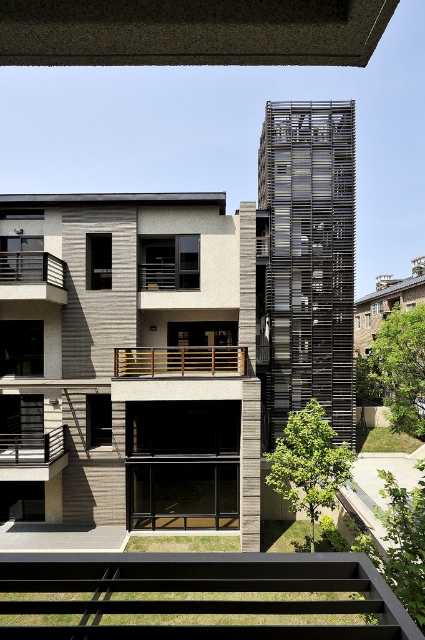
Question: Considering the real-world distances, which object is farthest from the black metal railing at lower left?

Choices:
 (A) wooden railing at center
 (B) brown wooden railing at left

Answer: (B)

Question: Among these objects, which one is farthest from the camera?

Choices:
 (A) brown wooden railing at left
 (B) black metal balustrade at lower center
 (C) black metal railing at lower left
 (D) wooden railing at center

Answer: (D)

Question: Is black metal balustrade at lower center to the right of brown wooden railing at left from the viewer's perspective?

Choices:
 (A) yes
 (B) no

Answer: (A)

Question: Considering the real-world distances, which object is farthest from the brown wooden railing at left?

Choices:
 (A) black metal balustrade at lower center
 (B) wooden railing at center
 (C) black metal railing at lower left

Answer: (A)

Question: Does black metal balustrade at lower center have a greater width compared to black metal railing at lower left?

Choices:
 (A) no
 (B) yes

Answer: (B)

Question: Can you confirm if wooden railing at center is thinner than black metal railing at lower left?

Choices:
 (A) yes
 (B) no

Answer: (B)